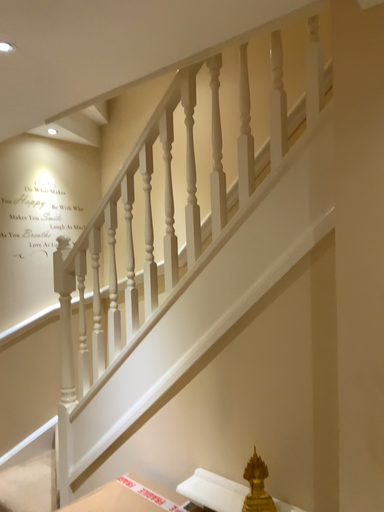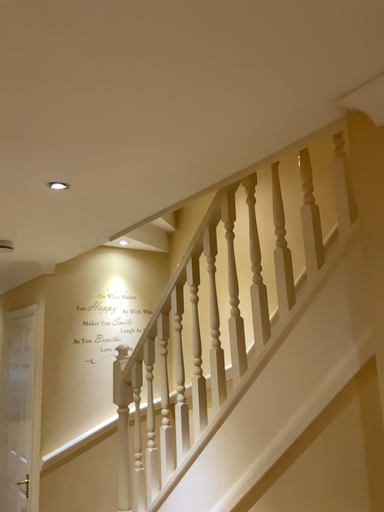
Question: How did the camera likely rotate when shooting the video?

Choices:
 (A) rotated left
 (B) rotated right

Answer: (A)